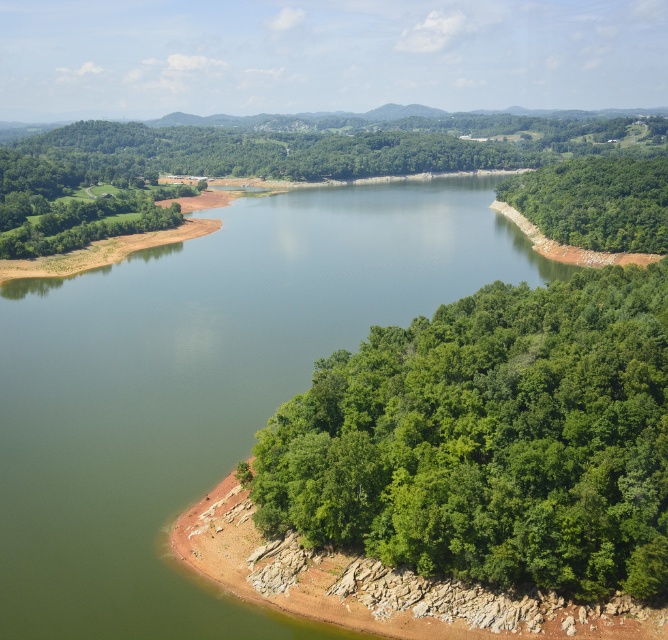
Who is positioned more to the right, green leafy forest at lower right or green leafy trees at right?

Positioned to the right is green leafy trees at right.

Which is below, green leafy forest at lower right or green leafy trees at right?

green leafy forest at lower right is lower down.

Where is `green leafy forest at lower right`? The height and width of the screenshot is (640, 668). green leafy forest at lower right is located at coordinates (492, 440).

What do you see at coordinates (200, 385) in the screenshot? Image resolution: width=668 pixels, height=640 pixels. I see `green smooth water at center` at bounding box center [200, 385].

Who is more distant from viewer, (x=434, y=195) or (x=633, y=180)?

Point (x=434, y=195)

This screenshot has width=668, height=640. I want to click on green smooth water at center, so click(200, 385).

Who is lower down, green smooth water at center or green leafy forest at lower right?

green leafy forest at lower right is below.

Does green smooth water at center appear under green leafy forest at lower right?

Incorrect, green smooth water at center is not positioned below green leafy forest at lower right.

Who is more distant from viewer, (106,593) or (665,522)?

The point (106,593) is behind.

This screenshot has width=668, height=640. Find the location of `green smooth water at center`. green smooth water at center is located at coordinates click(200, 385).